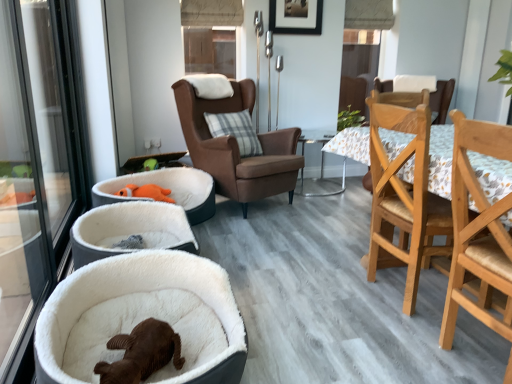
Locate an element on the screen. Image resolution: width=512 pixels, height=384 pixels. floral fabric table at center is located at coordinates (323, 181).

You are a GUI agent. You are given a task and a screenshot of the screen. Output one action in this format:
    pyautogui.click(x=<x>, y=<y>)
    Task: Click on the light wood/wooden dining chair at right, the third chair viewed from the back
    The width and height of the screenshot is (512, 384).
    Given the screenshot: What is the action you would take?
    pyautogui.click(x=478, y=230)

Identify the location of plaid fabric pillow at center. (234, 130).

Describe the element at coordinates (210, 35) in the screenshot. This screenshot has width=512, height=384. I see `transparent glass window at upper center` at that location.

The image size is (512, 384). What are the coordinates of `floral fabric table at center` in the screenshot? It's located at (323, 181).

Based on the photo, from the image's perspective, who appears lower, brown leather armchair at center, marked as the first chair in a back-to-front arrangement, or light brown wood chair at right, the 2th chair from the front?

light brown wood chair at right, the 2th chair from the front, from the image's perspective.

Is brown leather armchair at center, marked as the first chair in a back-to-front arrangement, bigger or smaller than light brown wood chair at right, the 2th chair from the front?

In the image, brown leather armchair at center, marked as the first chair in a back-to-front arrangement, appears to be larger than light brown wood chair at right, the 2th chair from the front.

Considering the relative positions of brown leather armchair at center, the 3th chair in the front-to-back sequence, and light brown wood chair at right, positioned as the 2th chair in back-to-front order, in the image provided, is brown leather armchair at center, the 3th chair in the front-to-back sequence, to the right of light brown wood chair at right, positioned as the 2th chair in back-to-front order, from the viewer's perspective?

No, brown leather armchair at center, the 3th chair in the front-to-back sequence, is not to the right of light brown wood chair at right, positioned as the 2th chair in back-to-front order.

How far apart are floral fabric table at center and plaid fabric pillow at center?

floral fabric table at center is 84.58 centimeters from plaid fabric pillow at center.

Is floral fabric table at center positioned behind plaid fabric pillow at center?

Yes.

Between floral fabric table at center and plaid fabric pillow at center, which one has smaller size?

Smaller between the two is plaid fabric pillow at center.

Consider the image. Is white plush dog bed at lower left beside wooden picture frame at upper center?

white plush dog bed at lower left and wooden picture frame at upper center are clearly separated.

From a real-world perspective, is white plush dog bed at lower left physically located above or below wooden picture frame at upper center?

Clearly, from a real-world perspective, white plush dog bed at lower left is below wooden picture frame at upper center.

At what (x,y) coordinates should I click in order to perform the action: click on dog bed on the left side of wooden picture frame at upper center. Please return your answer as a coordinate pair (x, y). This screenshot has width=512, height=384. Looking at the image, I should click on (139, 291).

I want to click on picture frame on the right of brown leather armchair at center, the 3th chair in the front-to-back sequence, so click(x=296, y=16).

Is brown leather armchair at center, marked as the first chair in a back-to-front arrangement, aimed at wooden picture frame at upper center?

No, brown leather armchair at center, marked as the first chair in a back-to-front arrangement, is not aimed at wooden picture frame at upper center.

Is brown leather armchair at center, the 3th chair in the front-to-back sequence, directly adjacent to wooden picture frame at upper center?

brown leather armchair at center, the 3th chair in the front-to-back sequence, and wooden picture frame at upper center are clearly separated.

From a real-world perspective, is white plush dog bed at lower left located higher than floral fabric table at center?

No, from a real-world perspective, white plush dog bed at lower left is not above floral fabric table at center.

Looking at this image, is floral fabric table at center surrounded by white plush dog bed at lower left?

No, floral fabric table at center is not a part of white plush dog bed at lower left.

Looking at their sizes, would you say white plush dog bed at lower left is wider or thinner than floral fabric table at center?

white plush dog bed at lower left is wider than floral fabric table at center.

How many degrees apart are the facing directions of white plush dog bed at lower left and floral fabric table at center?

There is a 94.2-degree angle between the facing directions of white plush dog bed at lower left and floral fabric table at center.

Is light wood/wooden dining chair at right, the third chair viewed from the back, aimed at wooden picture frame at upper center?

No, light wood/wooden dining chair at right, the third chair viewed from the back, is not turned towards wooden picture frame at upper center.

Is point (465, 270) in front of point (289, 0)?

Yes, it is.

Can you confirm if light wood/wooden dining chair at right, the third chair viewed from the back, is positioned to the left of wooden picture frame at upper center?

Incorrect, light wood/wooden dining chair at right, the third chair viewed from the back, is not on the left side of wooden picture frame at upper center.

Is light wood/wooden dining chair at right, the 1th chair positioned from the front, next to wooden picture frame at upper center and touching it?

They are not placed beside each other.

Which is correct: white plush dog bed at lower left is inside green leafy plant at upper center, or outside of it?

white plush dog bed at lower left exists outside the volume of green leafy plant at upper center.

How distant is white plush dog bed at lower left from green leafy plant at upper center?

The distance of white plush dog bed at lower left from green leafy plant at upper center is 3.14 meters.

Is point (196, 291) less distant than point (353, 117)?

Yes, it is.

From the image's perspective, is white plush dog bed at lower left located beneath green leafy plant at upper center?

Yes.

Which chair is the 1st one when counting from the right side of the brown leather armchair at center, the 3th chair in the front-to-back sequence? Please provide its 2D coordinates.

[(404, 193)]

Locate an element on the screen. The height and width of the screenshot is (384, 512). pillow lying on the left of floral fabric table at center is located at coordinates (234, 130).

Looking at the image, which one is located further to white plush dog bed at lower left, plaid fabric pillow at center or transparent glass window at upper center?

Based on the image, transparent glass window at upper center appears to be further to white plush dog bed at lower left.

Considering their positions, is transparent glass window at upper center positioned further to green leafy plant at upper center than wooden picture frame at upper center?

Among the two, transparent glass window at upper center is located further to green leafy plant at upper center.

Which object lies nearer to the anchor point green leafy plant at upper center, white plush dog bed at lower left or floral fabric table at center?

floral fabric table at center.

When comparing their distances from white plush dog bed at lower left, does transparent glass window at upper center or wooden picture frame at upper center seem closer?

The object closer to white plush dog bed at lower left is transparent glass window at upper center.

From the image, which object appears to be nearer to transparent glass window at upper center, plaid fabric pillow at center or white plush dog bed at lower left?

plaid fabric pillow at center is positioned closer to the anchor transparent glass window at upper center.

In the scene shown: When comparing their distances from light brown wood chair at right, the 2th chair from the front, does transparent glass window at upper center or wooden picture frame at upper center seem closer?

Among the two, wooden picture frame at upper center is located nearer to light brown wood chair at right, the 2th chair from the front.

Considering their positions, is brown leather armchair at center, the 3th chair in the front-to-back sequence, positioned closer to light wood/wooden dining chair at right, the third chair viewed from the back, than wooden picture frame at upper center?

Based on the image, brown leather armchair at center, the 3th chair in the front-to-back sequence, appears to be nearer to light wood/wooden dining chair at right, the third chair viewed from the back.

From the image, which object appears to be farther from brown leather armchair at center, marked as the first chair in a back-to-front arrangement, white plush dog bed at lower left or plaid fabric pillow at center?

white plush dog bed at lower left is positioned further to the anchor brown leather armchair at center, marked as the first chair in a back-to-front arrangement.

Identify the location of chair located between light brown wood chair at right, positioned as the 2th chair in back-to-front order, and plaid fabric pillow at center in the depth direction. The image size is (512, 384). (238, 147).

Where is `pillow between white plush dog bed at lower left and green leafy plant at upper center in the front-back direction`? This screenshot has width=512, height=384. pillow between white plush dog bed at lower left and green leafy plant at upper center in the front-back direction is located at coordinates (234, 130).

Locate an element on the screen. Image resolution: width=512 pixels, height=384 pixels. pillow located between brown leather armchair at center, the 3th chair in the front-to-back sequence, and transparent glass window at upper center in the depth direction is located at coordinates (234, 130).

You are a GUI agent. You are given a task and a screenshot of the screen. Output one action in this format:
    pyautogui.click(x=<x>, y=<y>)
    Task: Click on the pillow positioned between light wood/wooden dining chair at right, the third chair viewed from the back, and wooden picture frame at upper center from near to far
    The height and width of the screenshot is (384, 512).
    Given the screenshot: What is the action you would take?
    (x=234, y=130)